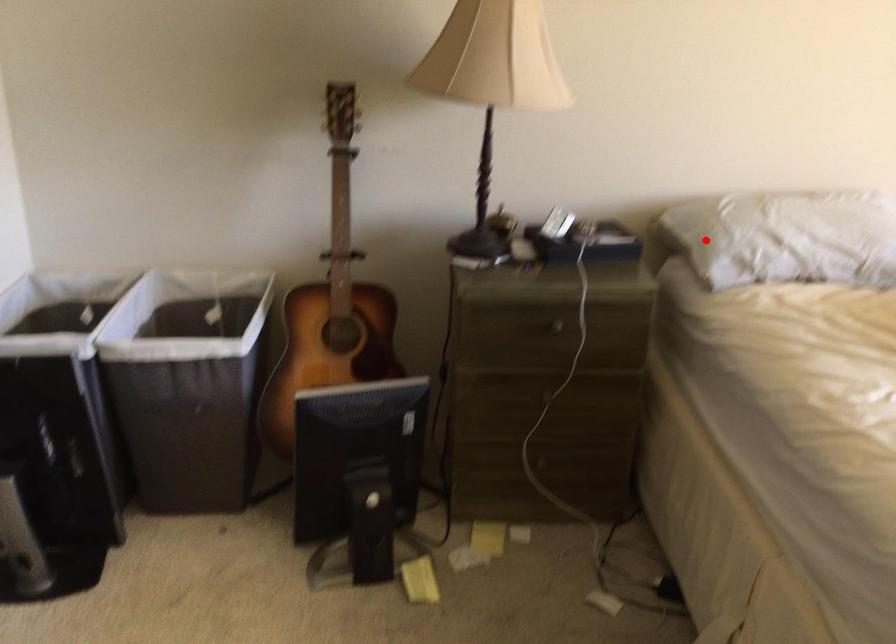
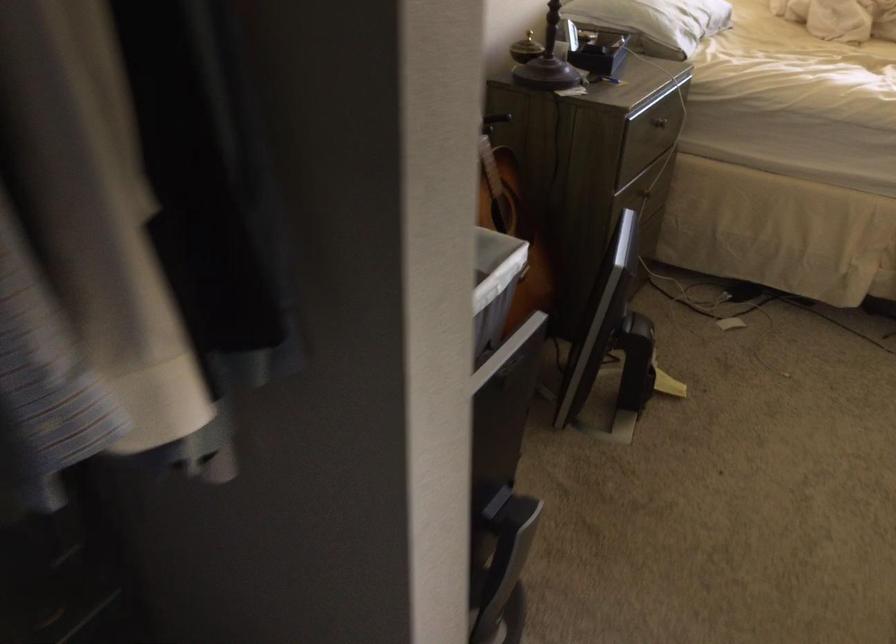
Where in the second image is the point corresponding to the highlighted location from the first image?

(655, 21)